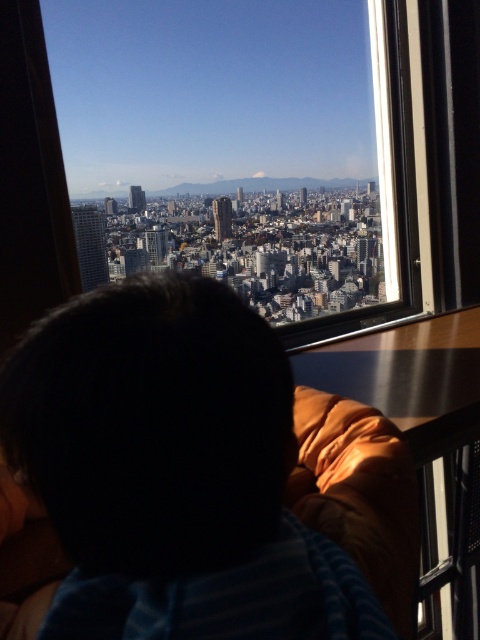
Find the location of a particular element. This screenshot has width=480, height=640. transparent glass window at center is located at coordinates (245, 148).

Does point (193, 8) lie in front of point (112, 506)?

No, (193, 8) is further to viewer.

Which is in front, point (417, 244) or point (55, 522)?

Positioned in front is point (55, 522).

This screenshot has height=640, width=480. I want to click on transparent glass window at center, so click(x=245, y=148).